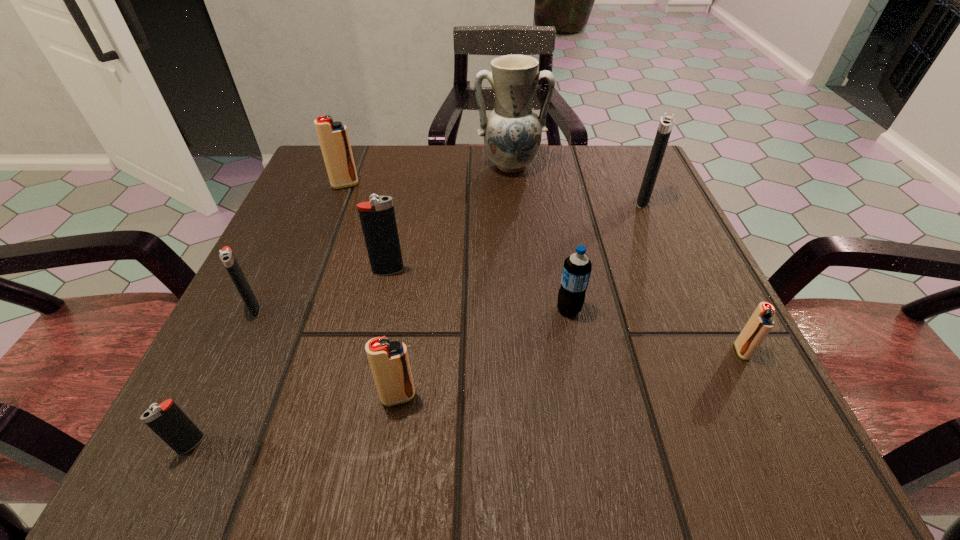
Identify the location of vacant region between the biggest black igniter and the second smallest black igniter. (449, 254).

The width and height of the screenshot is (960, 540). Find the location of `free space between the biggest black igniter and the nearest igniter`. free space between the biggest black igniter and the nearest igniter is located at coordinates (418, 322).

Where is `free area in between the soda bottle and the eighth shortest object`? The width and height of the screenshot is (960, 540). free area in between the soda bottle and the eighth shortest object is located at coordinates (606, 255).

In order to click on free area in between the nearest object and the second farthest red igniter in this screenshot , I will do `click(467, 398)`.

The height and width of the screenshot is (540, 960). In order to click on object that stands as the second closest to the soda bottle in this screenshot , I will do `click(389, 361)`.

You are a GUI agent. You are given a task and a screenshot of the screen. Output one action in this format:
    pyautogui.click(x=<x>, y=<y>)
    Task: Click on the object that stands as the eighth closest to the second igniter from right to left
    The width and height of the screenshot is (960, 540).
    Given the screenshot: What is the action you would take?
    pyautogui.click(x=167, y=420)

Identify which igniter is located as the second nearest to the sixth nearest igniter. Please provide its 2D coordinates. Your answer should be formatted as a tuple, i.e. [(x, y)], where the tuple contains the x and y coordinates of a point satisfying the conditions above.

[(377, 217)]

Find the location of a particular element. igniter object that ranks as the closest to the farthest igniter is located at coordinates (377, 217).

Identify which black igniter is located as the third nearest to the second farthest igniter. Please provide its 2D coordinates. Your answer should be formatted as a tuple, i.e. [(x, y)], where the tuple contains the x and y coordinates of a point satisfying the conditions above.

[(167, 420)]

This screenshot has height=540, width=960. What are the coordinates of `the second closest black igniter to the pottery` in the screenshot? It's located at (377, 217).